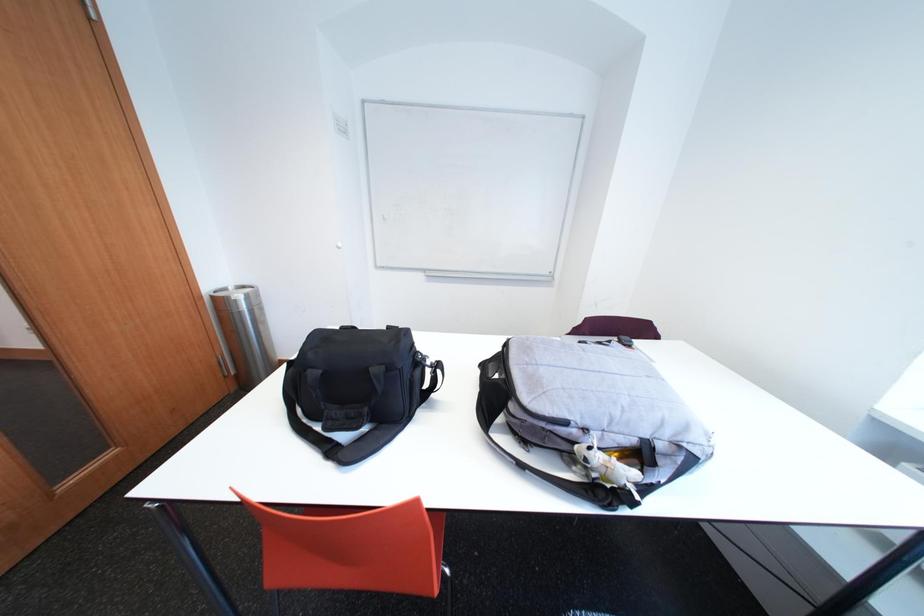
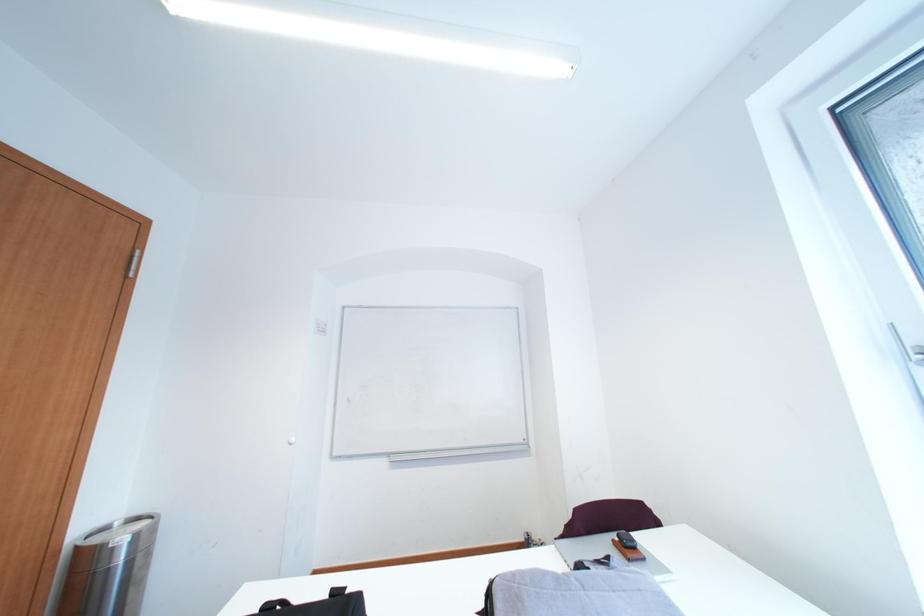
Question: How did the camera likely rotate?

Choices:
 (A) Left
 (B) Right
 (C) Up
 (D) Down

Answer: (C)